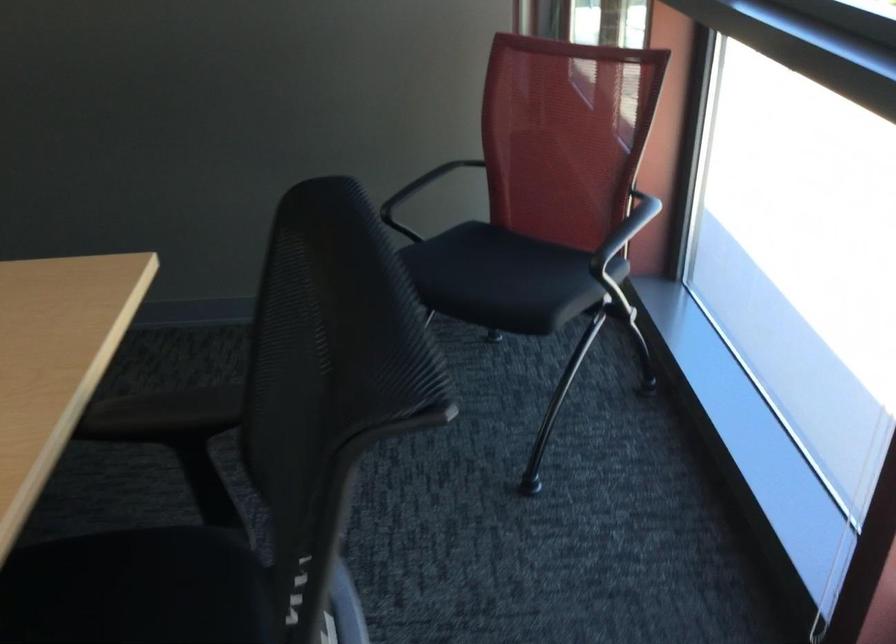
Question: The first image is from the beginning of the video and the second image is from the end. How did the camera likely rotate when shooting the video?

Choices:
 (A) Left
 (B) Right
 (C) Up
 (D) Down

Answer: (A)